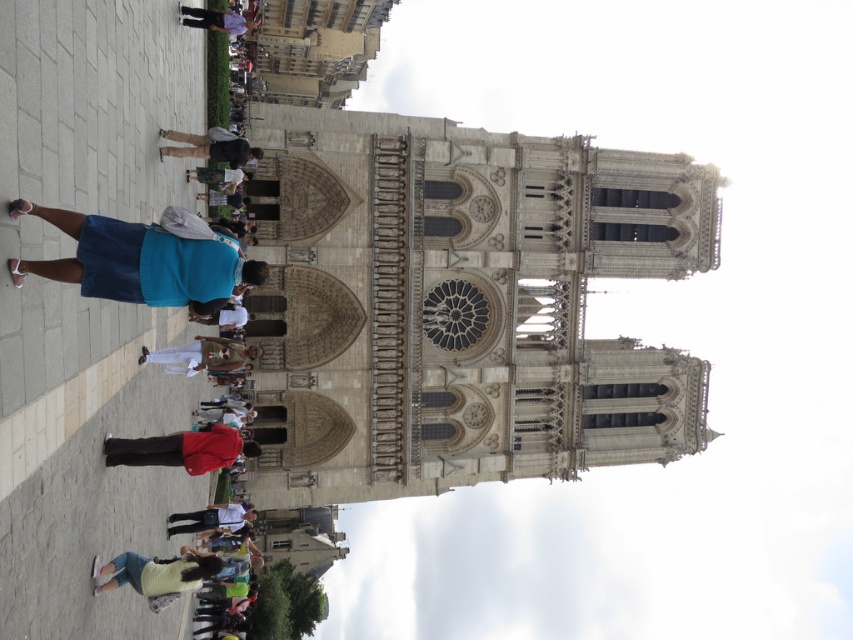
At what (x,y) coordinates should I click in order to perform the action: click on light yellow fabric at lower center. Please return your answer as a coordinate pair (x, y). Looking at the image, I should click on (155, 573).

Between light yellow fabric at lower center and purple cotton shirt at upper center, which one has less height?

Standing shorter between the two is light yellow fabric at lower center.

The image size is (853, 640). Identify the location of light yellow fabric at lower center. (155, 573).

You are a GUI agent. You are given a task and a screenshot of the screen. Output one action in this format:
    pyautogui.click(x=<x>, y=<y>)
    Task: Click on the light yellow fabric at lower center
    The width and height of the screenshot is (853, 640).
    Given the screenshot: What is the action you would take?
    pyautogui.click(x=155, y=573)

Does point (381, 401) come behind point (207, 353)?

That is True.

Is stone gothic cathedral at center to the left of light brown fabric pants at center from the viewer's perspective?

No, stone gothic cathedral at center is not to the left of light brown fabric pants at center.

Between point (325, 148) and point (173, 368), which one is positioned behind?

Positioned behind is point (325, 148).

What are the coordinates of `stone gothic cathedral at center` in the screenshot? It's located at (463, 305).

Which is in front, point (126, 232) or point (230, 163)?

Positioned in front is point (126, 232).

Does blue sweater at center have a greater width compared to dark brown leather jacket at center?

Indeed, blue sweater at center has a greater width compared to dark brown leather jacket at center.

Between point (119, 300) and point (200, 156), which one is positioned in front?

Point (119, 300) is in front.

The width and height of the screenshot is (853, 640). Find the location of `blue sweater at center`. blue sweater at center is located at coordinates (138, 262).